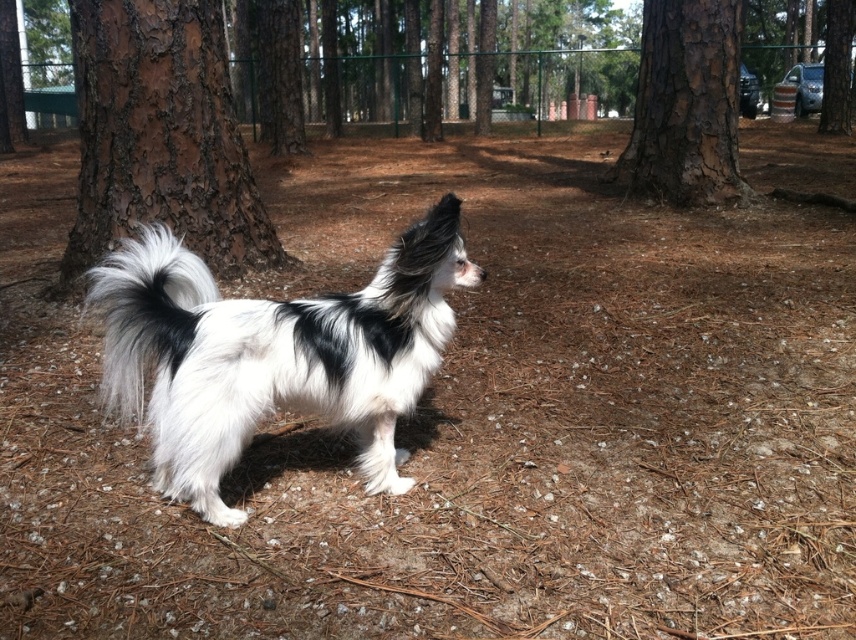
Does point (226, 396) come in front of point (209, 141)?

Yes, it is in front of point (209, 141).

The width and height of the screenshot is (856, 640). What do you see at coordinates (272, 353) in the screenshot?
I see `white fluffy dog at center` at bounding box center [272, 353].

Measure the distance between point (194, 436) and camera.

Point (194, 436) is 7.35 feet from camera.

The image size is (856, 640). I want to click on white fluffy dog at center, so click(272, 353).

Does white fluffy dog at center have a greater width compared to white fluffy tail at center?

Yes, white fluffy dog at center is wider than white fluffy tail at center.

Does point (444, 272) come behind point (141, 304)?

That is True.

Is point (146, 256) behind point (132, 412)?

No, it is in front of (132, 412).

You are a GUI agent. You are given a task and a screenshot of the screen. Output one action in this format:
    pyautogui.click(x=<x>, y=<y>)
    Task: Click on the white fluffy dog at center
    Image resolution: width=856 pixels, height=640 pixels.
    Given the screenshot: What is the action you would take?
    pyautogui.click(x=272, y=353)

Between point (232, 417) and point (663, 35), which one is positioned in front?

Positioned in front is point (232, 417).

Where is `white fluffy dog at center`? white fluffy dog at center is located at coordinates (272, 353).